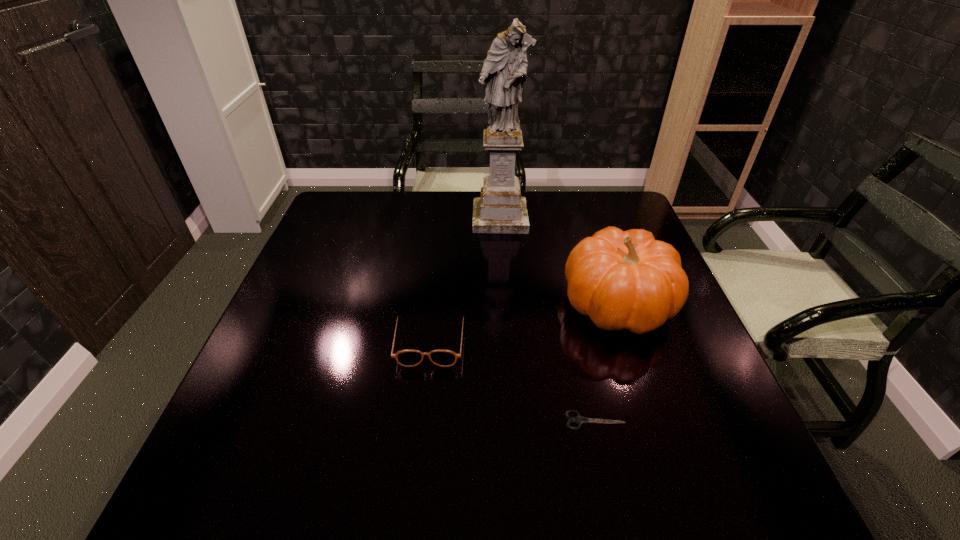
Where is `vacant space situated 0.130m on the left of the shears`? This screenshot has width=960, height=540. vacant space situated 0.130m on the left of the shears is located at coordinates [497, 420].

The width and height of the screenshot is (960, 540). What are the coordinates of `object positioned at the far edge` in the screenshot? It's located at (500, 209).

Identify the location of object that is positioned at the right edge. The width and height of the screenshot is (960, 540). click(628, 280).

Locate an element on the screen. free space at the far edge is located at coordinates (536, 228).

The width and height of the screenshot is (960, 540). In the image, there is a desktop. In order to click on vacant region at the near edge in this screenshot , I will do `click(401, 463)`.

I want to click on free space at the left edge of the desktop, so click(312, 385).

In the image, there is a desktop. Where is `vacant space at the far left corner`? vacant space at the far left corner is located at coordinates (372, 212).

What are the coordinates of `vacant space at the near left corner of the desktop` in the screenshot? It's located at (x=250, y=462).

Image resolution: width=960 pixels, height=540 pixels. In order to click on vacant space at the far right corner in this screenshot , I will do `click(599, 195)`.

Identify the location of unoccupied position between the nearest object and the farthest object. This screenshot has height=540, width=960. (547, 319).